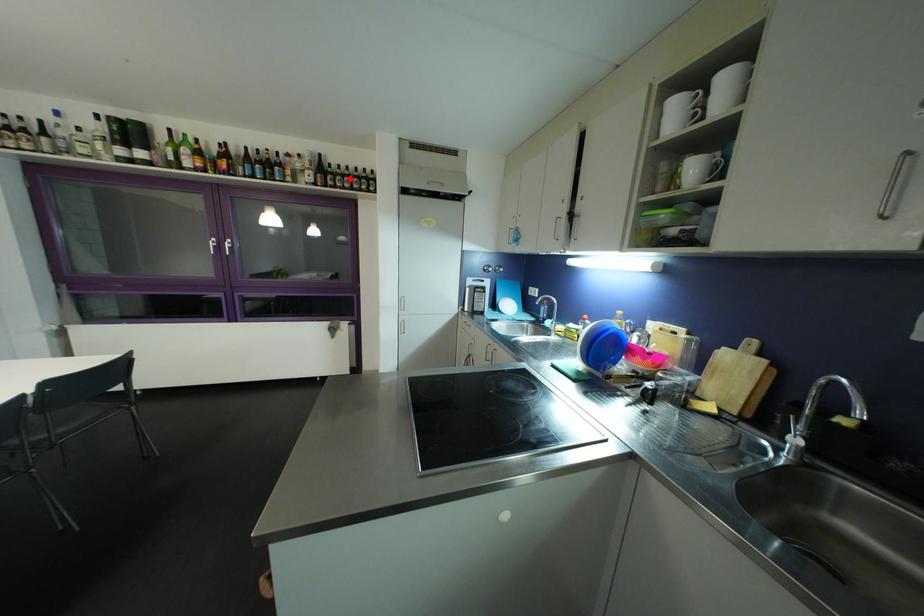
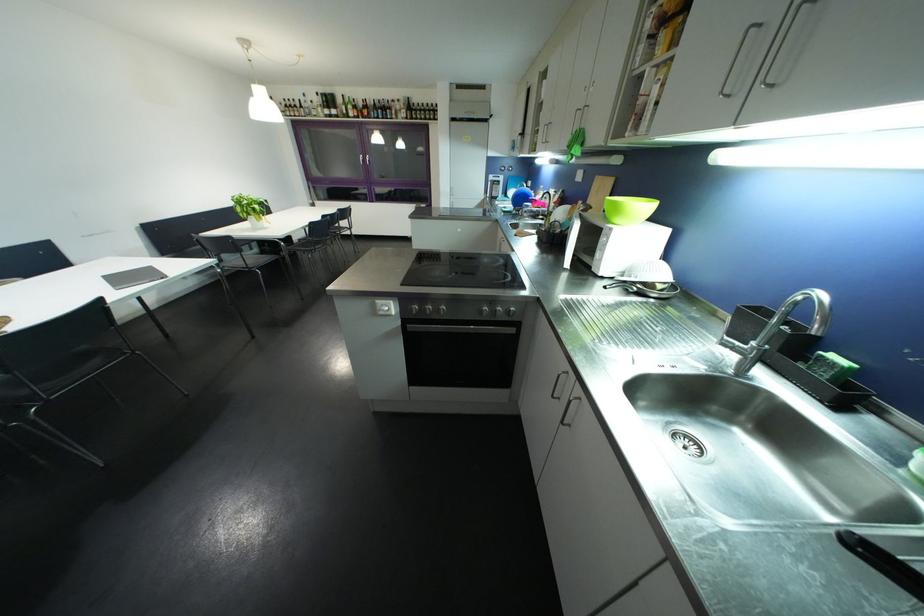
Locate, in the second image, the point that corresponds to the highlighted location in the first image.

(428, 113)